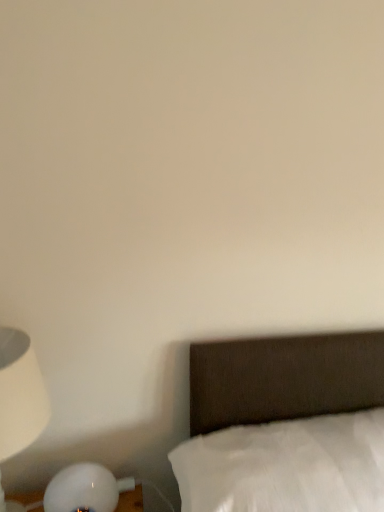
I want to click on white cotton bed at lower right, so click(x=282, y=380).

Describe the element at coordinates (282, 380) in the screenshot. This screenshot has height=512, width=384. I see `white cotton bed at lower right` at that location.

I want to click on white matte lamp at left, so click(x=20, y=394).

What do you see at coordinates (20, 394) in the screenshot? The image size is (384, 512). I see `white matte lamp at left` at bounding box center [20, 394].

Locate an element on the screen. The height and width of the screenshot is (512, 384). white cotton bed at lower right is located at coordinates (282, 380).

Does white cotton bed at lower right appear on the left side of white matte lamp at left?

In fact, white cotton bed at lower right is to the right of white matte lamp at left.

Which object is further away from the camera taking this photo, white cotton bed at lower right or white matte lamp at left?

white matte lamp at left is behind.

Which point is more distant from viewer, [291,394] or [32,395]?

Point [291,394]

From the image's perspective, is white cotton bed at lower right on white matte lamp at left?

No.

In the scene shown: From a real-world perspective, is white cotton bed at lower right above or below white matte lamp at left?

white cotton bed at lower right is situated lower than white matte lamp at left in the real world.

Does white cotton bed at lower right have a lesser width compared to white matte lamp at left?

No.

Considering the relative sizes of white cotton bed at lower right and white matte lamp at left in the image provided, is white cotton bed at lower right shorter than white matte lamp at left?

Yes, white cotton bed at lower right is shorter than white matte lamp at left.

In terms of size, does white cotton bed at lower right appear bigger or smaller than white matte lamp at left?

In the image, white cotton bed at lower right appears to be larger than white matte lamp at left.

Is white cotton bed at lower right positioned beyond the bounds of white matte lamp at left?

Yes, white cotton bed at lower right is located beyond the bounds of white matte lamp at left.

Based on the photo, is there a large distance between white cotton bed at lower right and white matte lamp at left?

No, there isn't a large distance between white cotton bed at lower right and white matte lamp at left.

Is white cotton bed at lower right turned away from white matte lamp at left?

No, white matte lamp at left is not at the back of white cotton bed at lower right.

How many degrees apart are the facing directions of white cotton bed at lower right and white matte lamp at left?

The angle between the facing direction of white cotton bed at lower right and the facing direction of white matte lamp at left is 5.78 degrees.

How far apart are white cotton bed at lower right and white matte lamp at left?

They are 21.38 inches apart.

What are the coordinates of `bed that appears on the right of white matte lamp at left` in the screenshot? It's located at (282, 380).

In the scene shown: Can you confirm if white matte lamp at left is positioned to the left of white cotton bed at lower right?

Yes, white matte lamp at left is to the left of white cotton bed at lower right.

Which object is more forward, white matte lamp at left or white cotton bed at lower right?

Positioned in front is white cotton bed at lower right.

Does point (32, 433) come farther from viewer compared to point (378, 367)?

No, it is in front of (378, 367).

From the image's perspective, would you say white matte lamp at left is positioned over white cotton bed at lower right?

Indeed, from the image's perspective, white matte lamp at left is shown above white cotton bed at lower right.

From a real-world perspective, is white matte lamp at left on top of white cotton bed at lower right?

Yes, from a real-world perspective, white matte lamp at left is over white cotton bed at lower right

Which object is thinner, white matte lamp at left or white cotton bed at lower right?

Thinner between the two is white matte lamp at left.

Considering the sizes of objects white matte lamp at left and white cotton bed at lower right in the image provided, who is taller, white matte lamp at left or white cotton bed at lower right?

white matte lamp at left.

Can you confirm if white matte lamp at left is smaller than white cotton bed at lower right?

Yes, white matte lamp at left is smaller than white cotton bed at lower right.

Is white matte lamp at left inside or outside of white cotton bed at lower right?

white matte lamp at left is spatially situated outside white cotton bed at lower right.

Would you consider white matte lamp at left to be distant from white cotton bed at lower right?

No, white matte lamp at left is not far away from white cotton bed at lower right.

Could you tell me if white matte lamp at left is facing white cotton bed at lower right?

No, white matte lamp at left is not oriented towards white cotton bed at lower right.

In the scene shown: How many degrees apart are the facing directions of white matte lamp at left and white cotton bed at lower right?

The facing directions of white matte lamp at left and white cotton bed at lower right are 5.78 degrees apart.

How distant is white matte lamp at left from white cotton bed at lower right?

21.38 inches.

Identify the location of lamp above the white cotton bed at lower right (from a real-world perspective). The image size is (384, 512). (20, 394).

In the image, there is a white cotton bed at lower right. Identify the location of lamp above it (from the image's perspective). This screenshot has height=512, width=384. (20, 394).

I want to click on lamp that appears on the left of white cotton bed at lower right, so (x=20, y=394).